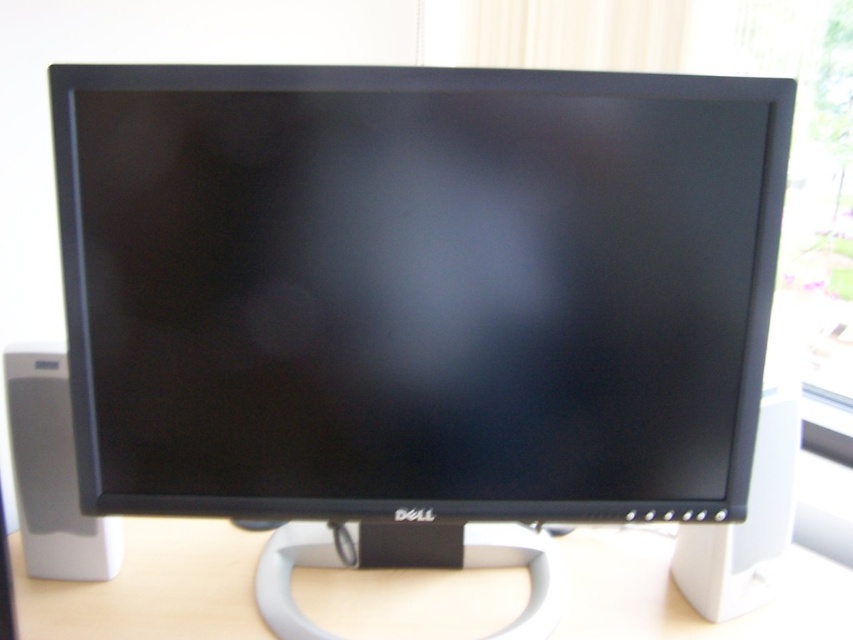
Describe the element at coordinates (152, 588) in the screenshot. I see `light wood computer desk at center` at that location.

Between light wood computer desk at center and white plastic speaker at left, which one is positioned lower?

light wood computer desk at center

Between point (350, 616) and point (28, 576), which one is positioned in front?

Point (350, 616) is in front.

Where is `light wood computer desk at center`? This screenshot has width=853, height=640. light wood computer desk at center is located at coordinates (152, 588).

Does light wood computer desk at center have a lesser width compared to white plastic speaker at right?

No.

Is light wood computer desk at center shorter than white plastic speaker at right?

Correct, light wood computer desk at center is not as tall as white plastic speaker at right.

What do you see at coordinates (152, 588) in the screenshot? The image size is (853, 640). I see `light wood computer desk at center` at bounding box center [152, 588].

Locate an element on the screen. The width and height of the screenshot is (853, 640). light wood computer desk at center is located at coordinates coord(152,588).

Which is behind, point (26, 502) or point (756, 534)?

Positioned behind is point (26, 502).

Does white plastic speaker at left have a lesser width compared to white plastic speaker at right?

Incorrect, white plastic speaker at left's width is not less than white plastic speaker at right's.

I want to click on white plastic speaker at left, so click(x=51, y=474).